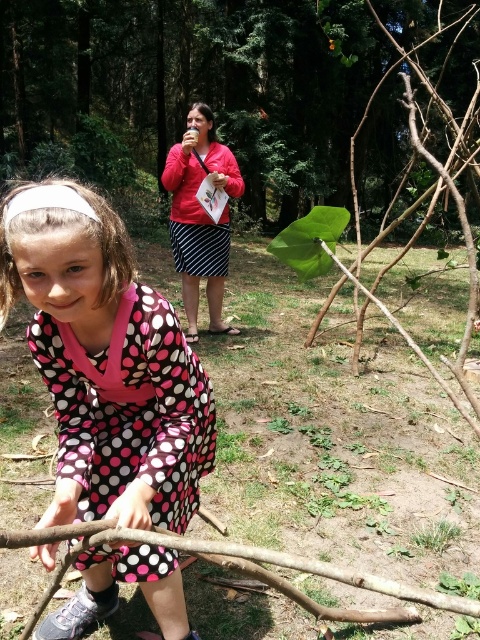
Question: Does green leafy plant at upper center appear over brown rough tree branch at center right?

Choices:
 (A) yes
 (B) no

Answer: (A)

Question: Among these points, which one is farthest from the camera?

Choices:
 (A) (177, 211)
 (B) (314, 51)

Answer: (B)

Question: Is green leafy plant at upper center wider than brown rough tree branch at center right?

Choices:
 (A) no
 (B) yes

Answer: (B)

Question: Can you confirm if green leafy plant at upper center is positioned above pink polka dot dress at lower left?

Choices:
 (A) yes
 (B) no

Answer: (A)

Question: Which object is farther from the camera taking this photo?

Choices:
 (A) brown rough tree branch at lower center
 (B) pink polka dot dress at lower left
 (C) brown rough tree branch at center right

Answer: (B)

Question: Which object is the closest to the pink dotted dress at lower left?

Choices:
 (A) brown rough tree branch at lower center
 (B) green leafy plant at upper center
 (C) pink polka dot dress at lower left
 (D) brown rough tree branch at center right

Answer: (C)